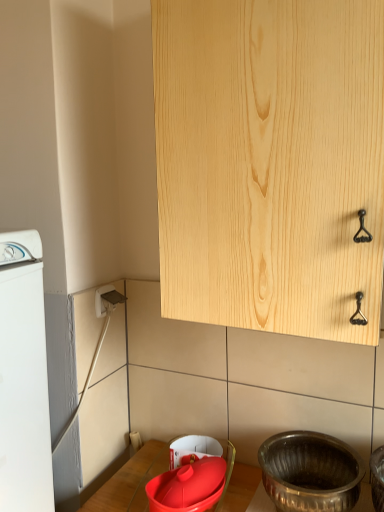
This screenshot has height=512, width=384. What do you see at coordinates (104, 300) in the screenshot?
I see `white plastic electric outlet at lower left` at bounding box center [104, 300].

Describe the element at coordinates (23, 378) in the screenshot. I see `white plastic washing machine at left` at that location.

How much space does polished silver basin at lower right, marked as the first basin in a right-to-left arrangement, occupy vertically?

polished silver basin at lower right, marked as the first basin in a right-to-left arrangement, is 4.95 inches tall.

Measure the distance between point (341, 451) and camera.

A distance of 38.46 inches exists between point (341, 451) and camera.

Identify the location of white plastic electric outlet at lower left. (104, 300).

From the image's perspective, does matte red basin at lower center, positioned as the second basin in right-to-left order, appear lower than white plastic washing machine at left?

Yes, from the image's perspective, matte red basin at lower center, positioned as the second basin in right-to-left order, is below white plastic washing machine at left.

Find the location of a particular element. This screenshot has width=384, height=512. the 2nd basin located beneath the white plastic washing machine at left (from a real-world perspective) is located at coordinates (188, 486).

Is matte red basin at lower center, the first basin from the left, positioned before white plastic washing machine at left?

Yes, the depth of matte red basin at lower center, the first basin from the left, is less than that of white plastic washing machine at left.

Is matte red basin at lower center, the first basin from the left, not close to white plastic washing machine at left?

No.

From the image's perspective, which one is positioned lower, polished silver basin at lower right, marked as the first basin in a right-to-left arrangement, or natural wood cabinet at upper center?

polished silver basin at lower right, marked as the first basin in a right-to-left arrangement.

Does polished silver basin at lower right, the 2th basin when ordered from left to right, appear on the right side of natural wood cabinet at upper center?

Yes.

Is polished silver basin at lower right, the 2th basin when ordered from left to right, positioned beyond the bounds of natural wood cabinet at upper center?

Yes, polished silver basin at lower right, the 2th basin when ordered from left to right, is not within natural wood cabinet at upper center.

From a real-world perspective, which object rests below the other?

polished silver basin at lower right, the 2th basin when ordered from left to right, from a real-world perspective.

Between polished silver basin at lower right, marked as the first basin in a right-to-left arrangement, and matte red basin at lower center, the first basin from the left, which one has smaller width?

matte red basin at lower center, the first basin from the left, is thinner.

How many degrees apart are the facing directions of polished silver basin at lower right, marked as the first basin in a right-to-left arrangement, and matte red basin at lower center, the first basin from the left?

The facing directions of polished silver basin at lower right, marked as the first basin in a right-to-left arrangement, and matte red basin at lower center, the first basin from the left, are 8.33 degrees apart.

Is polished silver basin at lower right, marked as the first basin in a right-to-left arrangement, far from matte red basin at lower center, positioned as the second basin in right-to-left order?

polished silver basin at lower right, marked as the first basin in a right-to-left arrangement, is near matte red basin at lower center, positioned as the second basin in right-to-left order, not far away.

Considering the relative positions of white plastic washing machine at left and polished silver basin at lower right, the 2th basin when ordered from left to right, in the image provided, is white plastic washing machine at left to the right of polished silver basin at lower right, the 2th basin when ordered from left to right, from the viewer's perspective?

No.

Based on the photo, can you confirm if white plastic washing machine at left is thinner than polished silver basin at lower right, the 2th basin when ordered from left to right?

Indeed, white plastic washing machine at left has a lesser width compared to polished silver basin at lower right, the 2th basin when ordered from left to right.

From a real-world perspective, who is located higher, white plastic washing machine at left or polished silver basin at lower right, marked as the first basin in a right-to-left arrangement?

white plastic washing machine at left.

Identify the location of the 1st basin positioned below the white plastic washing machine at left (from the image's perspective). This screenshot has width=384, height=512. (310, 472).

Does matte red basin at lower center, positioned as the second basin in right-to-left order, lie in front of polished silver basin at lower right, marked as the first basin in a right-to-left arrangement?

No, matte red basin at lower center, positioned as the second basin in right-to-left order, is behind polished silver basin at lower right, marked as the first basin in a right-to-left arrangement.

From the image's perspective, who appears lower, matte red basin at lower center, positioned as the second basin in right-to-left order, or polished silver basin at lower right, marked as the first basin in a right-to-left arrangement?

matte red basin at lower center, positioned as the second basin in right-to-left order, appears lower in the image.

Is matte red basin at lower center, the first basin from the left, inside or outside of polished silver basin at lower right, marked as the first basin in a right-to-left arrangement?

The correct answer is: outside.

Is natural wood cabinet at upper center bigger or smaller than white plastic electric outlet at lower left?

natural wood cabinet at upper center is bigger than white plastic electric outlet at lower left.

From a real-world perspective, between natural wood cabinet at upper center and white plastic electric outlet at lower left, who is vertically lower?

In real-world perspective, white plastic electric outlet at lower left is lower.

How many degrees apart are the facing directions of natural wood cabinet at upper center and white plastic electric outlet at lower left?

90 degrees.

Does natural wood cabinet at upper center have a greater width compared to white plastic electric outlet at lower left?

Yes, natural wood cabinet at upper center is wider than white plastic electric outlet at lower left.

From a real-world perspective, is white plastic washing machine at left beneath natural wood cabinet at upper center?

Correct, in the physical world, white plastic washing machine at left is lower than natural wood cabinet at upper center.

The width and height of the screenshot is (384, 512). I want to click on cabinetry above the white plastic washing machine at left (from the image's perspective), so click(x=270, y=163).

Could you tell me if white plastic washing machine at left is turned towards natural wood cabinet at upper center?

No, white plastic washing machine at left is not aimed at natural wood cabinet at upper center.

Would you say white plastic washing machine at left is a long distance from natural wood cabinet at upper center?

No, white plastic washing machine at left is in close proximity to natural wood cabinet at upper center.

In the image, there is a matte red basin at lower center, positioned as the second basin in right-to-left order. Where is `home appliance above it (from the image's perspective)`? home appliance above it (from the image's perspective) is located at coordinates (23, 378).

This screenshot has height=512, width=384. There is a polished silver basin at lower right, marked as the first basin in a right-to-left arrangement. In order to click on cabinetry above it (from a real-world perspective) in this screenshot , I will do `click(270, 163)`.

When comparing their distances from white plastic washing machine at left, does matte red basin at lower center, positioned as the second basin in right-to-left order, or natural wood cabinet at upper center seem closer?

The object closer to white plastic washing machine at left is matte red basin at lower center, positioned as the second basin in right-to-left order.

Looking at the image, which one is located further to white plastic washing machine at left, polished silver basin at lower right, marked as the first basin in a right-to-left arrangement, or natural wood cabinet at upper center?

polished silver basin at lower right, marked as the first basin in a right-to-left arrangement, is further to white plastic washing machine at left.

From the picture: When comparing their distances from natural wood cabinet at upper center, does white plastic washing machine at left or white plastic electric outlet at lower left seem closer?

white plastic washing machine at left is closer to natural wood cabinet at upper center.

Based on their spatial positions, is polished silver basin at lower right, the 2th basin when ordered from left to right, or white plastic washing machine at left closer to white plastic electric outlet at lower left?

white plastic washing machine at left lies closer to white plastic electric outlet at lower left than the other object.

Estimate the real-world distances between objects in this image. Which object is further from white plastic electric outlet at lower left, white plastic washing machine at left or natural wood cabinet at upper center?

natural wood cabinet at upper center lies further to white plastic electric outlet at lower left than the other object.

From the image, which object appears to be nearer to natural wood cabinet at upper center, matte red basin at lower center, the first basin from the left, or white plastic washing machine at left?

The object closer to natural wood cabinet at upper center is white plastic washing machine at left.

Considering their positions, is white plastic electric outlet at lower left positioned closer to matte red basin at lower center, positioned as the second basin in right-to-left order, than natural wood cabinet at upper center?

The object closer to matte red basin at lower center, positioned as the second basin in right-to-left order, is white plastic electric outlet at lower left.

Which object lies nearer to the anchor point matte red basin at lower center, the first basin from the left, polished silver basin at lower right, the 2th basin when ordered from left to right, or natural wood cabinet at upper center?

Among the two, polished silver basin at lower right, the 2th basin when ordered from left to right, is located nearer to matte red basin at lower center, the first basin from the left.

In order to click on electric outlet between natural wood cabinet at upper center and matte red basin at lower center, the first basin from the left, in the vertical direction in this screenshot , I will do `click(104, 300)`.

Identify the location of electric outlet between white plastic washing machine at left and polished silver basin at lower right, the 2th basin when ordered from left to right, in the horizontal direction. (104, 300).

Find the location of a particular element. The width and height of the screenshot is (384, 512). basin situated between white plastic washing machine at left and polished silver basin at lower right, the 2th basin when ordered from left to right, from left to right is located at coordinates (188, 486).

This screenshot has height=512, width=384. Identify the location of electric outlet between natural wood cabinet at upper center and white plastic washing machine at left from top to bottom. (104, 300).